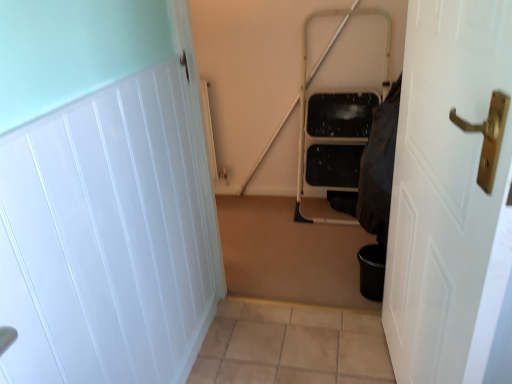
The width and height of the screenshot is (512, 384). What are the coordinates of `white glossy door at right, the first door positioned from the right` in the screenshot? It's located at (450, 199).

Image resolution: width=512 pixels, height=384 pixels. I want to click on white glossy door at left, which is the second door in right-to-left order, so click(x=103, y=193).

Can you tell me how much white glossy door at right, the first door positioned from the right, and white glossy door at left, marked as the 1th door in a left-to-right arrangement, differ in facing direction?

The angle between the facing direction of white glossy door at right, the first door positioned from the right, and the facing direction of white glossy door at left, marked as the 1th door in a left-to-right arrangement, is 172 degrees.

Is white glossy door at right, the first door positioned from the right, oriented towards white glossy door at left, which is the second door in right-to-left order?

Yes, white glossy door at right, the first door positioned from the right, is oriented towards white glossy door at left, which is the second door in right-to-left order.

Which is in front, white glossy door at right, the first door positioned from the right, or white glossy door at left, marked as the 1th door in a left-to-right arrangement?

white glossy door at right, the first door positioned from the right, is closer to the camera.

Which of these two, white glossy door at right, the first door positioned from the right, or white glossy door at left, which is the second door in right-to-left order, is wider?

With larger width is white glossy door at right, the first door positioned from the right.

Considering the relative positions of white glossy door at left, which is the second door in right-to-left order, and white glossy door at right, the first door positioned from the right, in the image provided, is white glossy door at left, which is the second door in right-to-left order, in front of white glossy door at right, the first door positioned from the right,?

No, white glossy door at left, which is the second door in right-to-left order, is behind white glossy door at right, the first door positioned from the right.

Could you tell me if white glossy door at left, marked as the 1th door in a left-to-right arrangement, is facing white glossy door at right, the first door positioned from the right?

Yes.

From the image's perspective, is white glossy door at left, marked as the 1th door in a left-to-right arrangement, beneath white glossy door at right, the first door positioned from the right?

Correct, white glossy door at left, marked as the 1th door in a left-to-right arrangement, appears lower than white glossy door at right, the first door positioned from the right, in the image.

Based on the photo, which of these two, white glossy door at left, which is the second door in right-to-left order, or black fabric at right, is smaller?

black fabric at right.

Is white glossy door at left, which is the second door in right-to-left order, turned away from black fabric at right?

white glossy door at left, which is the second door in right-to-left order, does not have its back to black fabric at right.

In terms of width, does white glossy door at left, marked as the 1th door in a left-to-right arrangement, look wider or thinner when compared to black fabric at right?

Clearly, white glossy door at left, marked as the 1th door in a left-to-right arrangement, has less width compared to black fabric at right.

Which object is further away from the camera, black fabric at right or white glossy door at right, marked as the second door in a left-to-right arrangement?

black fabric at right is further from the camera.

Based on the photo, is black fabric at right turned away from white glossy door at right, the first door positioned from the right?

No.

Is black fabric at right not near white glossy door at right, the first door positioned from the right?

No, there isn't a large distance between black fabric at right and white glossy door at right, the first door positioned from the right.

Looking at the image, does white glossy door at right, the first door positioned from the right, seem bigger or smaller compared to black fabric at right?

Clearly, white glossy door at right, the first door positioned from the right, is larger in size than black fabric at right.

Considering the positions of objects white glossy door at right, marked as the second door in a left-to-right arrangement, and black fabric at right in the image provided, who is more to the left, white glossy door at right, marked as the second door in a left-to-right arrangement, or black fabric at right?

white glossy door at right, marked as the second door in a left-to-right arrangement, is more to the left.

Does point (400, 219) lie behind point (371, 170)?

No, it is in front of (371, 170).

From the image's perspective, which one is positioned lower, white glossy door at right, the first door positioned from the right, or black fabric at right?

white glossy door at right, the first door positioned from the right, appears lower in the image.

Between black fabric at right and white glossy door at left, which is the second door in right-to-left order, which one has more height?

white glossy door at left, which is the second door in right-to-left order.

How much distance is there between black fabric at right and white glossy door at left, marked as the 1th door in a left-to-right arrangement?

black fabric at right and white glossy door at left, marked as the 1th door in a left-to-right arrangement, are 32.16 inches apart.

Find the location of a particular element. material above the white glossy door at left, marked as the 1th door in a left-to-right arrangement (from the image's perspective) is located at coordinates (379, 167).

Which object is positioned more to the right, black fabric at right or white glossy door at left, which is the second door in right-to-left order?

black fabric at right is more to the right.

Locate an element on the screen. Image resolution: width=512 pixels, height=384 pixels. door above the white glossy door at left, which is the second door in right-to-left order (from the image's perspective) is located at coordinates (450, 199).

Where is `door below the white glossy door at right, marked as the second door in a left-to-right arrangement (from a real-world perspective)`? door below the white glossy door at right, marked as the second door in a left-to-right arrangement (from a real-world perspective) is located at coordinates (103, 193).

In the scene shown: Based on their spatial positions, is white glossy door at left, which is the second door in right-to-left order, or white glossy door at right, marked as the second door in a left-to-right arrangement, closer to black fabric at right?

The object closer to black fabric at right is white glossy door at right, marked as the second door in a left-to-right arrangement.

Estimate the real-world distances between objects in this image. Which object is further from white glossy door at left, which is the second door in right-to-left order, black fabric at right or white glossy door at right, marked as the second door in a left-to-right arrangement?

black fabric at right is further to white glossy door at left, which is the second door in right-to-left order.

Looking at the image, which one is located further to white glossy door at left, marked as the 1th door in a left-to-right arrangement, white glossy door at right, the first door positioned from the right, or black fabric at right?

The object further to white glossy door at left, marked as the 1th door in a left-to-right arrangement, is black fabric at right.

Estimate the real-world distances between objects in this image. Which object is further from white glossy door at right, the first door positioned from the right, white glossy door at left, which is the second door in right-to-left order, or black fabric at right?

white glossy door at left, which is the second door in right-to-left order.

Looking at the image, which one is located closer to white glossy door at right, the first door positioned from the right, black fabric at right or white glossy door at left, marked as the 1th door in a left-to-right arrangement?

black fabric at right is closer to white glossy door at right, the first door positioned from the right.

When comparing their distances from black fabric at right, does white glossy door at right, the first door positioned from the right, or white glossy door at left, which is the second door in right-to-left order, seem further?

Among the two, white glossy door at left, which is the second door in right-to-left order, is located further to black fabric at right.

Locate an element on the screen. The image size is (512, 384). door between white glossy door at right, the first door positioned from the right, and black fabric at right, along the z-axis is located at coordinates (103, 193).